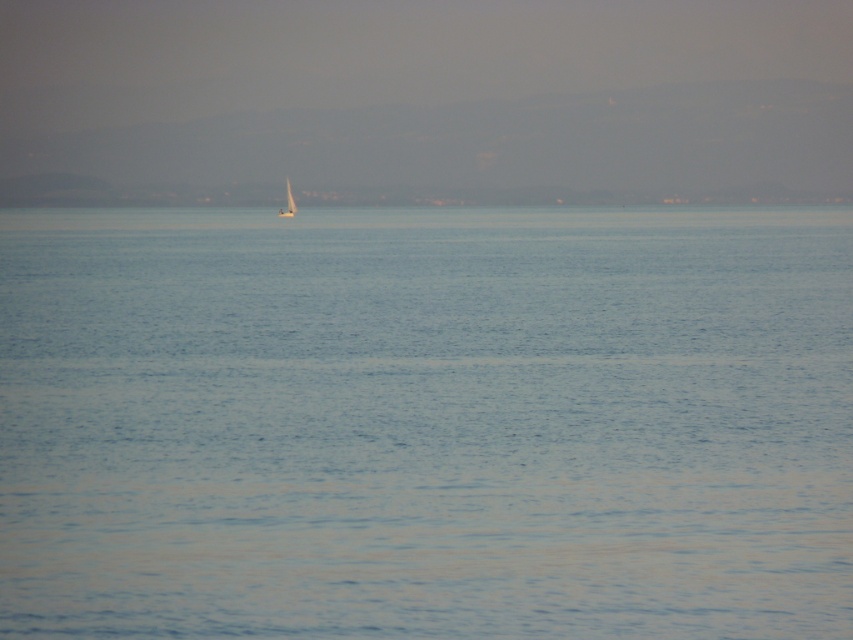
Consider the image. You are standing on a cliff overlooking the seascape. You notice the blue smooth water at center and the white matte sailboat at center. Which object is positioned lower in the scene?

The blue smooth water at center is positioned lower than the white matte sailboat at center in the scene.

You are standing on a cliff overlooking the seascape. You see the blue water at center and the white sailboat at center. Which object appears taller from your viewpoint?

The white sailboat at center appears taller than the blue water at center because the blue water at center is not as tall as the white sailboat at center.

You are standing at the edge of the water and want to place a buoy exactly where the blue smooth water at center is located. According to the coordinates provided, where should you place the buoy?

The blue smooth water at center is located at point coordinates (425, 422) so you should place the buoy there.